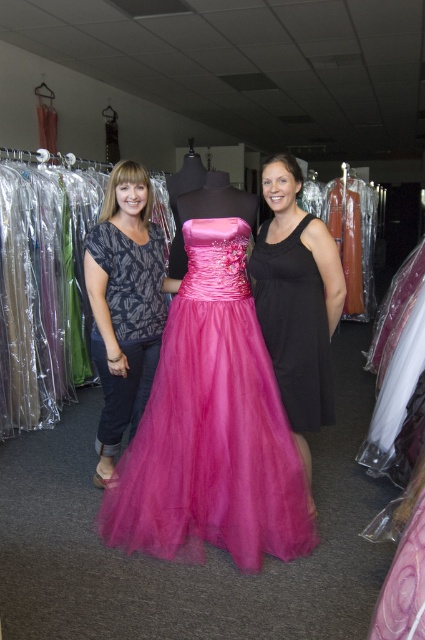
Question: Does fuchsia tulle dress at center appear on the right side of satin tulle dress at center?

Choices:
 (A) no
 (B) yes

Answer: (A)

Question: From the image, what is the correct spatial relationship of matte black blouse at center in relation to satin tulle dress at center?

Choices:
 (A) right
 (B) left

Answer: (B)

Question: Which of the following is the closest to the observer?

Choices:
 (A) (116, 180)
 (B) (266, 500)
 (C) (261, 276)

Answer: (B)

Question: Based on their relative distances, which object is farther from the fuchsia tulle dress at center?

Choices:
 (A) matte black blouse at center
 (B) satin tulle dress at center

Answer: (A)

Question: Is fuchsia tulle dress at center to the left of satin tulle dress at center from the viewer's perspective?

Choices:
 (A) no
 (B) yes

Answer: (B)

Question: Which of these objects is positioned closest to the matte black blouse at center?

Choices:
 (A) fuchsia tulle dress at center
 (B) satin tulle dress at center

Answer: (A)